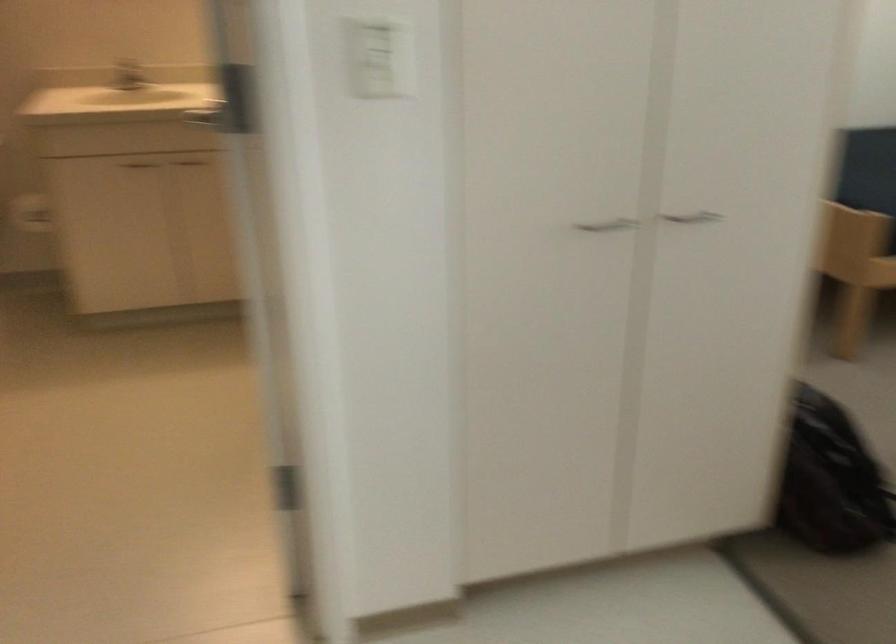
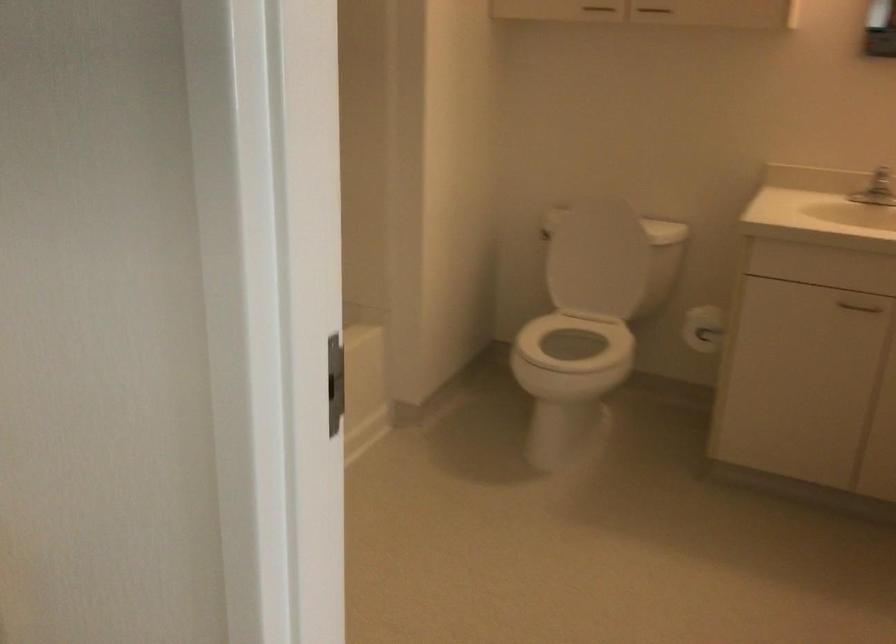
Locate, in the second image, the point that corresponds to the point at 131,67 in the first image.

(881, 182)